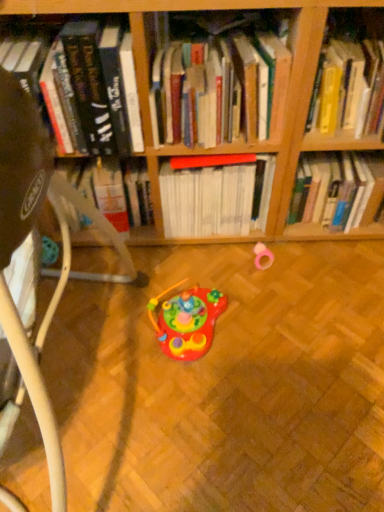
This screenshot has width=384, height=512. In order to click on pink rubber ring at center right, which is counted as the first toy, starting from the back in this screenshot , I will do `click(262, 256)`.

Identify the location of shiny plastic toy at center, which is counted as the 2th toy, starting from the top. (187, 320).

The width and height of the screenshot is (384, 512). What do you see at coordinates (347, 84) in the screenshot? I see `yellow hardcover book at upper right, which is the first book in right-to-left order` at bounding box center [347, 84].

The width and height of the screenshot is (384, 512). Identify the location of red matte book at center, acting as the 2th book starting from the right. (216, 199).

Considering the relative sizes of hardcover book at left, the first book from the left, and red matte book at center, acting as the 2th book starting from the right, in the image provided, is hardcover book at left, the first book from the left, bigger than red matte book at center, acting as the 2th book starting from the right,?

Indeed, hardcover book at left, the first book from the left, has a larger size compared to red matte book at center, acting as the 2th book starting from the right.

Who is shorter, hardcover book at left, the 4th book when ordered from right to left, or red matte book at center, acting as the 2th book starting from the right?

hardcover book at left, the 4th book when ordered from right to left.

Is hardcover book at left, the 4th book when ordered from right to left, facing towards red matte book at center, which is the third book in left-to-right order?

No, hardcover book at left, the 4th book when ordered from right to left, is not aimed at red matte book at center, which is the third book in left-to-right order.

From the picture: In the image, is hardcover book at left, the 4th book when ordered from right to left, on the left side or the right side of yellow hardcover book at upper right, the 4th book viewed from the left?

From the image, it's evident that hardcover book at left, the 4th book when ordered from right to left, is to the left of yellow hardcover book at upper right, the 4th book viewed from the left.

Between point (96, 77) and point (335, 39), which one is positioned in front?

Point (96, 77)

From the image's perspective, does hardcover book at left, the first book from the left, appear higher than yellow hardcover book at upper right, which is the first book in right-to-left order?

Actually, hardcover book at left, the first book from the left, appears below yellow hardcover book at upper right, which is the first book in right-to-left order, in the image.

How much distance is there between hardcover book at left, the first book from the left, and yellow hardcover book at upper right, the 4th book viewed from the left?

hardcover book at left, the first book from the left, is 23.11 inches away from yellow hardcover book at upper right, the 4th book viewed from the left.

From a real-world perspective, relative to red matte book at center, which is the third book in left-to-right order, is pink rubber ring at center right, which is counted as the first toy, starting from the back, vertically above or below?

In terms of real-world spatial position, pink rubber ring at center right, which is counted as the first toy, starting from the back, is below red matte book at center, which is the third book in left-to-right order.

Which is further, (268, 249) or (197, 227)?

Point (268, 249)

Considering the relative sizes of pink rubber ring at center right, arranged as the 2th toy when viewed from the front, and red matte book at center, acting as the 2th book starting from the right, in the image provided, is pink rubber ring at center right, arranged as the 2th toy when viewed from the front, wider than red matte book at center, acting as the 2th book starting from the right,?

No.

Considering the sizes of pink rubber ring at center right, which is counted as the first toy, starting from the back, and red matte book at center, which is the third book in left-to-right order, in the image, is pink rubber ring at center right, which is counted as the first toy, starting from the back, bigger or smaller than red matte book at center, which is the third book in left-to-right order,?

Considering their sizes, pink rubber ring at center right, which is counted as the first toy, starting from the back, takes up less space than red matte book at center, which is the third book in left-to-right order.

Is yellow hardcover book at upper right, which is the first book in right-to-left order, facing away from red matte book at center, which is the third book in left-to-right order?

No, yellow hardcover book at upper right, which is the first book in right-to-left order,'s orientation is not away from red matte book at center, which is the third book in left-to-right order.

From the image's perspective, is yellow hardcover book at upper right, the 4th book viewed from the left, on top of red matte book at center, acting as the 2th book starting from the right?

Yes, from the image's perspective, yellow hardcover book at upper right, the 4th book viewed from the left, is over red matte book at center, acting as the 2th book starting from the right.

Does yellow hardcover book at upper right, the 4th book viewed from the left, have a greater height compared to red matte book at center, which is the third book in left-to-right order?

No.

Considering the relative sizes of yellow hardcover book at upper right, the 4th book viewed from the left, and red matte book at center, acting as the 2th book starting from the right, in the image provided, is yellow hardcover book at upper right, the 4th book viewed from the left, thinner than red matte book at center, acting as the 2th book starting from the right,?

Incorrect, the width of yellow hardcover book at upper right, the 4th book viewed from the left, is not less than that of red matte book at center, acting as the 2th book starting from the right.

The image size is (384, 512). I want to click on book that is the 2nd one when counting forward from the hardcover books at center, arranged as the 2th book when viewed from the left, so coord(89,84).

Is hardcover book at left, the first book from the left, closer to the viewer compared to hardcover books at center, arranged as the 2th book when viewed from the left?

Yes, hardcover book at left, the first book from the left, is in front of hardcover books at center, arranged as the 2th book when viewed from the left.

Which is more to the left, hardcover book at left, the first book from the left, or hardcover books at center, arranged as the 2th book when viewed from the left?

hardcover book at left, the first book from the left.

From a real-world perspective, relative to hardcover books at center, arranged as the 2th book when viewed from the left, is hardcover book at left, the 4th book when ordered from right to left, vertically above or below?

In terms of real-world spatial position, hardcover book at left, the 4th book when ordered from right to left, is above hardcover books at center, arranged as the 2th book when viewed from the left.

Which of these two, shiny plastic toy at center, placed as the 2th toy when sorted from right to left, or red matte book at center, acting as the 2th book starting from the right, is wider?

Wider between the two is shiny plastic toy at center, placed as the 2th toy when sorted from right to left.

Does shiny plastic toy at center, positioned as the 2th toy in back-to-front order, have a greater height compared to red matte book at center, acting as the 2th book starting from the right?

No.

From the image's perspective, which is above, shiny plastic toy at center, which is counted as the 2th toy, starting from the top, or red matte book at center, acting as the 2th book starting from the right?

red matte book at center, acting as the 2th book starting from the right.

Which object is closer to the camera, shiny plastic toy at center, which is counted as the 2th toy, starting from the top, or red matte book at center, which is the third book in left-to-right order?

shiny plastic toy at center, which is counted as the 2th toy, starting from the top, is more forward.

From a real-world perspective, which object rests below the other?

white plastic swivel chair at lower left, from a real-world perspective.

Is white plastic swivel chair at lower left aimed at yellow hardcover book at upper right, which is the first book in right-to-left order?

No.

In the image, there is a hardcover book at left, the 4th book when ordered from right to left. At what (x,y) coordinates should I click in order to perform the action: click on book below it (from the image's perspective). Please return your answer as a coordinate pair (x, y). The height and width of the screenshot is (512, 384). Looking at the image, I should click on (216, 199).

Locate an element on the screen. This screenshot has width=384, height=512. the 3rd book to the right when counting from the hardcover book at left, the 4th book when ordered from right to left is located at coordinates (347, 84).

Estimate the real-world distances between objects in this image. Which object is further from pink rubber ring at center right, the second toy ordered from the bottom, hardcover books at center, which ranks as the 3th book in right-to-left order, or hardcover book at left, the 4th book when ordered from right to left?

hardcover book at left, the 4th book when ordered from right to left, is positioned further to the anchor pink rubber ring at center right, the second toy ordered from the bottom.

Looking at this image, when comparing their distances from yellow hardcover book at upper right, the 4th book viewed from the left, does white plastic swivel chair at lower left or shiny plastic toy at center, positioned as the 2th toy in back-to-front order, seem further?

white plastic swivel chair at lower left is further to yellow hardcover book at upper right, the 4th book viewed from the left.

Estimate the real-world distances between objects in this image. Which object is further from hardcover book at left, the first book from the left, red matte book at center, acting as the 2th book starting from the right, or shiny plastic toy at center, marked as the 1th toy in a front-to-back arrangement?

Among the two, shiny plastic toy at center, marked as the 1th toy in a front-to-back arrangement, is located further to hardcover book at left, the first book from the left.

Estimate the real-world distances between objects in this image. Which object is further from hardcover books at center, arranged as the 2th book when viewed from the left, shiny plastic toy at center, positioned as the 2th toy in back-to-front order, or pink rubber ring at center right, the second toy ordered from the bottom?

shiny plastic toy at center, positioned as the 2th toy in back-to-front order.

Based on their spatial positions, is pink rubber ring at center right, acting as the second toy starting from the left, or red matte book at center, which is the third book in left-to-right order, closer to yellow hardcover book at upper right, which is the first book in right-to-left order?

Based on the image, red matte book at center, which is the third book in left-to-right order, appears to be nearer to yellow hardcover book at upper right, which is the first book in right-to-left order.

Looking at the image, which one is located further to hardcover books at center, which ranks as the 3th book in right-to-left order, shiny plastic toy at center, which is the first toy in left-to-right order, or white plastic swivel chair at lower left?

shiny plastic toy at center, which is the first toy in left-to-right order.

Which object lies further to the anchor point pink rubber ring at center right, which ranks as the first toy in top-to-bottom order, shiny plastic toy at center, which is the 1th toy in bottom-to-top order, or hardcover book at left, the 4th book when ordered from right to left?

hardcover book at left, the 4th book when ordered from right to left, lies further to pink rubber ring at center right, which ranks as the first toy in top-to-bottom order, than the other object.

Estimate the real-world distances between objects in this image. Which object is closer to white plastic swivel chair at lower left, pink rubber ring at center right, the second toy ordered from the bottom, or hardcover book at left, the first book from the left?

hardcover book at left, the first book from the left.

You are a GUI agent. You are given a task and a screenshot of the screen. Output one action in this format:
    pyautogui.click(x=<x>, y=<y>)
    Task: Click on the toy between red matte book at center, which is the third book in left-to-right order, and shiny plastic toy at center, marked as the 1th toy in a front-to-back arrangement, vertically
    The width and height of the screenshot is (384, 512).
    Given the screenshot: What is the action you would take?
    262,256

You are a GUI agent. You are given a task and a screenshot of the screen. Output one action in this format:
    pyautogui.click(x=<x>, y=<y>)
    Task: Click on the toy between white plastic swivel chair at lower left and pink rubber ring at center right, which is counted as the first toy, starting from the back, along the z-axis
    Image resolution: width=384 pixels, height=512 pixels.
    Given the screenshot: What is the action you would take?
    pyautogui.click(x=187, y=320)

The image size is (384, 512). Find the location of `book between hardcover books at center, arranged as the 2th book when viewed from the left, and yellow hardcover book at upper right, the 4th book viewed from the left`. book between hardcover books at center, arranged as the 2th book when viewed from the left, and yellow hardcover book at upper right, the 4th book viewed from the left is located at coordinates (216, 199).

The height and width of the screenshot is (512, 384). Identify the location of book located between hardcover book at left, the first book from the left, and red matte book at center, acting as the 2th book starting from the right, in the left-right direction. (216, 80).